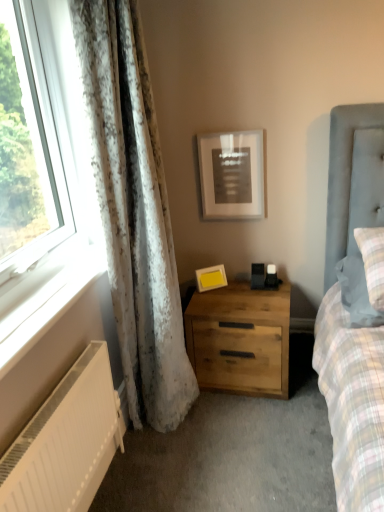
At what (x,y) coordinates should I click in order to perform the action: click on vacant space situated above white matte radiator at lower left (from a real-world perspective). Please return your answer as a coordinate pair (x, y). Looking at the image, I should click on (46, 410).